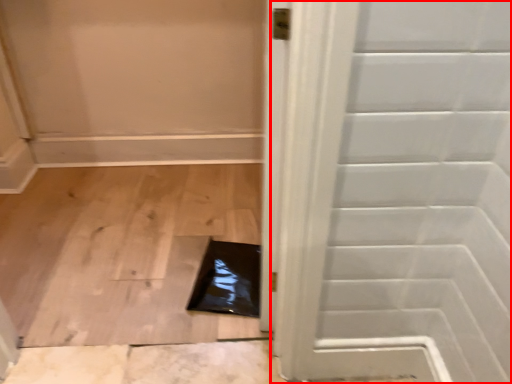
Question: From the image's perspective, what is the correct spatial positioning of door (annotated by the red box) in reference to hole?

Choices:
 (A) above
 (B) below

Answer: (A)